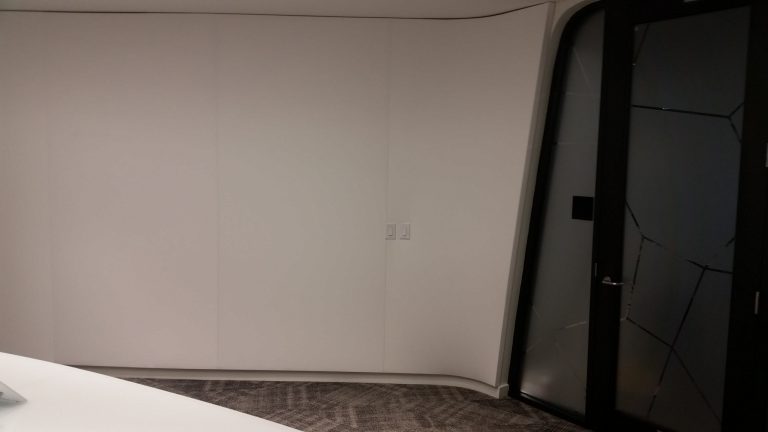
Identify the location of door jam. The height and width of the screenshot is (432, 768). click(x=524, y=258).